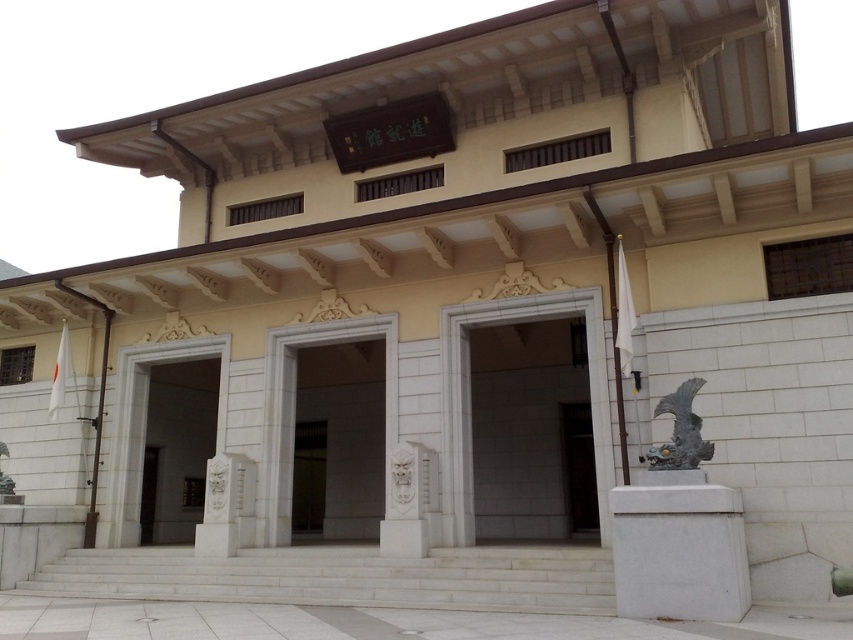
Is white marble entrance at center to the right of white stone door at center from the viewer's perspective?

Indeed, white marble entrance at center is positioned on the right side of white stone door at center.

Between white marble entrance at center and white stone door at center, which one is positioned higher?

Positioned higher is white marble entrance at center.

Is point (309, 419) closer to camera compared to point (212, 396)?

Yes.

You are a GUI agent. You are given a task and a screenshot of the screen. Output one action in this format:
    pyautogui.click(x=<x>, y=<y>)
    Task: Click on the white marble entrance at center
    The height and width of the screenshot is (640, 853).
    Given the screenshot: What is the action you would take?
    pyautogui.click(x=339, y=440)

Which is below, white marble pillar at lower right or white stone door at center?

white stone door at center is lower down.

Can you confirm if white marble pillar at lower right is wider than white stone door at center?

Yes.

Who is more distant from viewer, (680,493) or (178,488)?

Positioned behind is point (178,488).

Locate an element on the screen. white marble pillar at lower right is located at coordinates (677, 548).

Which of these two, white tile wall at center or white stone door at center, stands shorter?

white stone door at center is shorter.

Is point (534, 458) less distant than point (207, 433)?

Yes, it is in front of point (207, 433).

Which is in front, point (556, 513) or point (160, 440)?

Point (556, 513) is more forward.

Where is `white tile wall at center`? white tile wall at center is located at coordinates (531, 432).